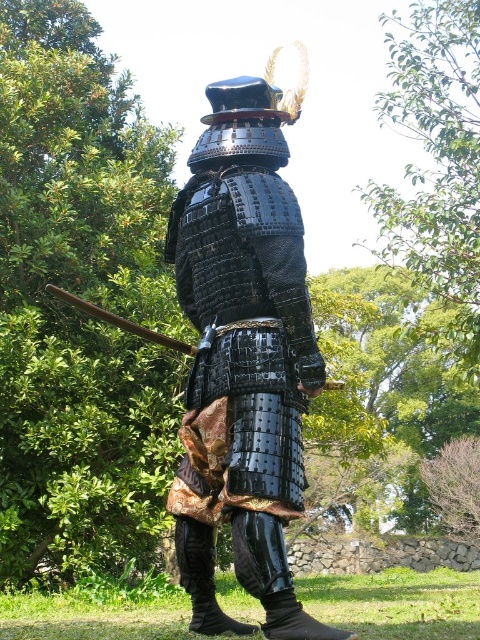
You are a historian examining this samurai figure. Based on the scene, which object is closer to you, the glossy black armor at center or the brown wooden staff at left?

The glossy black armor at center is closer to you because it is positioned in front of the brown wooden staff at left.

Looking at this image, you are a warrior in the scene and want to move your brown wooden staff at left to the right side of your glossy black armor at center. Is the staff currently positioned to the left or right of the armor?

The glossy black armor at center is to the right of the brown wooden staff at left, so the staff is currently positioned to the left of the armor.

You are a historian examining this image of a samurai. You need to determine the relative size of the objects in the scene. Which object, the glossy black armor at center or the brown wooden staff at left, is taller?

The glossy black armor at center is taller than the brown wooden staff at left according to the description.